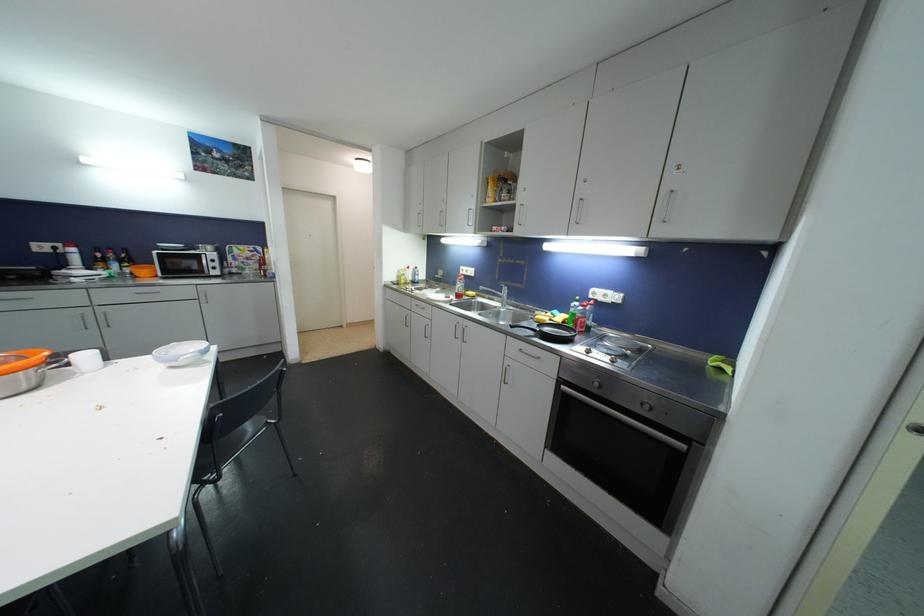
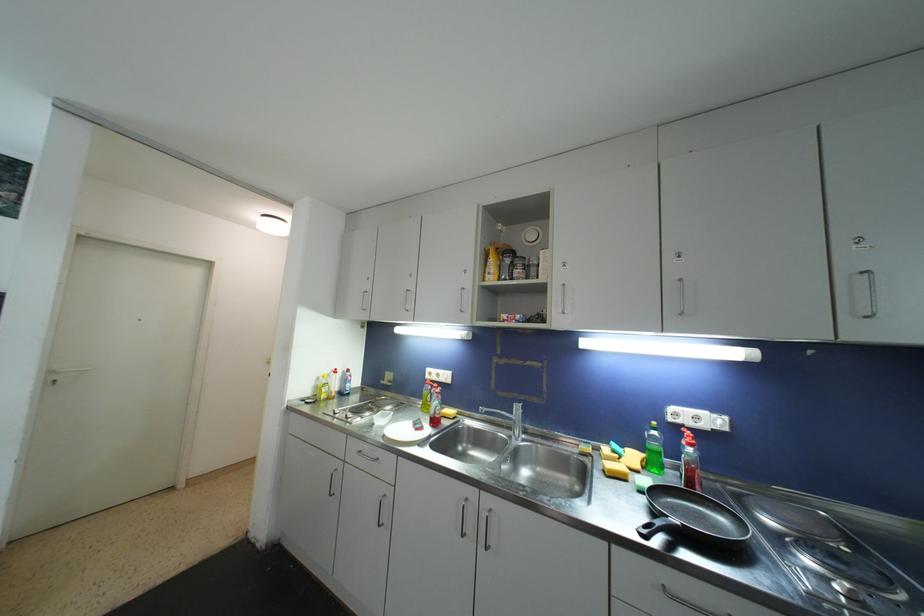
The point at (469, 274) is marked in the first image. Where is the corresponding point in the second image?

(441, 378)